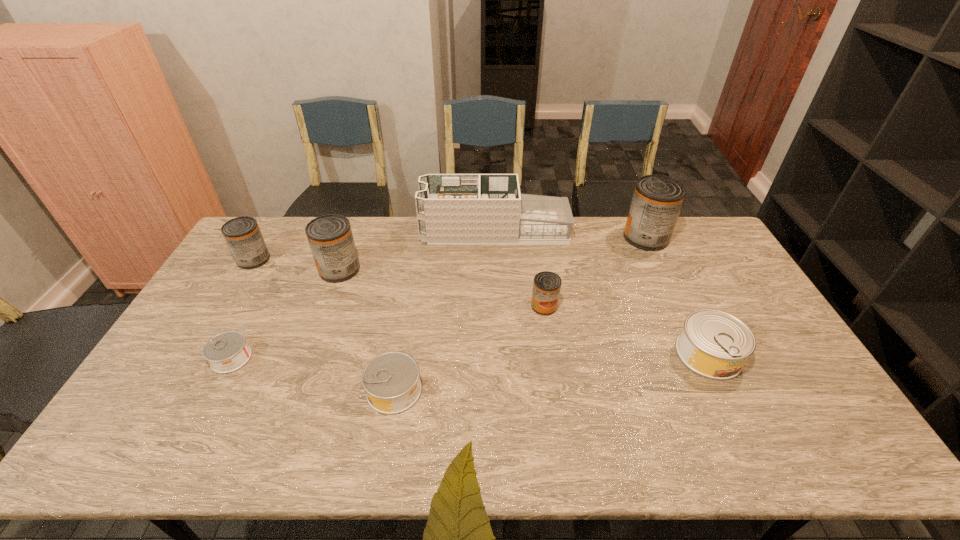
Locate an element on the screen. silver can that is the second closest to the fourth tallest object is located at coordinates (391, 380).

What are the coordinates of `free space in the image that satisfies the following two spatial constraints: 1. at the entrance of the nearest red can; 2. on the right side of the dollhouse` in the screenshot? It's located at (497, 306).

This screenshot has width=960, height=540. In order to click on vacant area in the image that satisfies the following two spatial constraints: 1. at the entrance of the fourth nearest can; 2. on the left side of the dollhouse in this screenshot , I will do `click(497, 306)`.

Where is `vacant region that satisfies the following two spatial constraints: 1. on the back side of the second silver can from right to left; 2. on the left side of the biggest silver can`? This screenshot has width=960, height=540. vacant region that satisfies the following two spatial constraints: 1. on the back side of the second silver can from right to left; 2. on the left side of the biggest silver can is located at coordinates (400, 354).

In order to click on free location that satisfies the following two spatial constraints: 1. at the entrance of the dollhouse; 2. on the left side of the tallest can in this screenshot , I will do `click(495, 238)`.

Where is `free space that satisfies the following two spatial constraints: 1. on the back side of the nearest red can; 2. at the entrance of the dollhouse`? free space that satisfies the following two spatial constraints: 1. on the back side of the nearest red can; 2. at the entrance of the dollhouse is located at coordinates (533, 231).